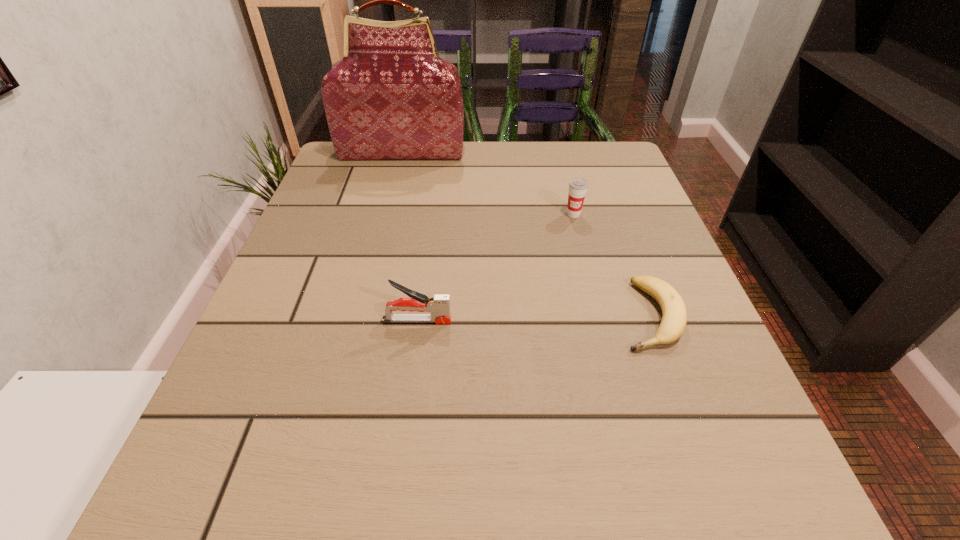
Identify the location of free space located on the left of the rightmost object. This screenshot has height=540, width=960. (395, 315).

This screenshot has width=960, height=540. Find the location of `object positioned at the far edge`. object positioned at the far edge is located at coordinates (391, 96).

The height and width of the screenshot is (540, 960). What are the coordinates of `object situated at the left edge` in the screenshot? It's located at (391, 96).

Where is `cup that is at the right edge`? The height and width of the screenshot is (540, 960). cup that is at the right edge is located at coordinates (578, 187).

Where is `banana at the right edge`? The height and width of the screenshot is (540, 960). banana at the right edge is located at coordinates (674, 319).

What are the coordinates of `object positioned at the far left corner` in the screenshot? It's located at [391, 96].

Where is `free space at the far edge of the desktop`? free space at the far edge of the desktop is located at coordinates point(539,145).

Image resolution: width=960 pixels, height=540 pixels. Identify the location of vacant space at the near edge. (520, 526).

Find the location of a particular element. This screenshot has height=540, width=960. vacant space at the left edge of the desktop is located at coordinates (324, 327).

The height and width of the screenshot is (540, 960). Find the location of `vacant space at the right edge of the desktop`. vacant space at the right edge of the desktop is located at coordinates (656, 450).